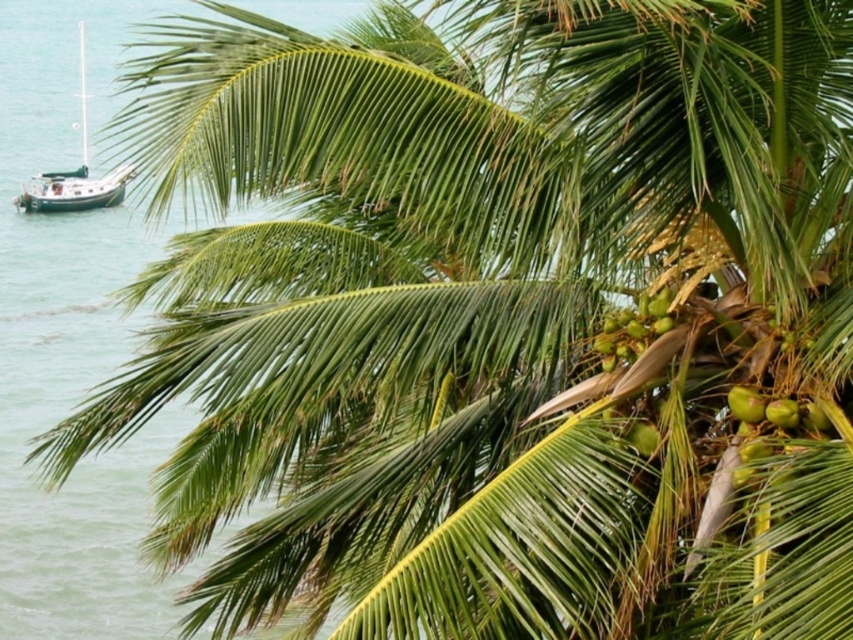
You are standing in front of the palm tree and want to take a photo of the point at coordinates point (605, 336). If your camera has a maximum focus range of 5 meters, will it be able to focus on that point?

The distance of point (605, 336) from camera is 5.36 meters, which is beyond the camera maximum focus range of 5 meters. Therefore, the camera will not be able to focus on that point.

What is the spatial relationship between the wooden sailboat at left and the green matte coconuts at upper right in the scene?

The green matte coconuts at upper right are positioned behind the wooden sailboat at left, meaning the sailboat is closer to the viewer while the coconuts are farther away in the background.